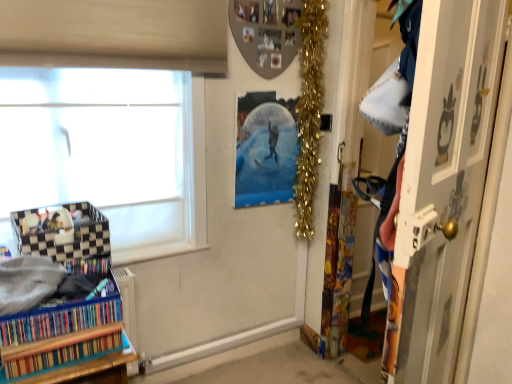
Where is `metallic silver snow globe at upper center`? This screenshot has height=384, width=512. metallic silver snow globe at upper center is located at coordinates (265, 149).

The height and width of the screenshot is (384, 512). Describe the element at coordinates (265, 149) in the screenshot. I see `metallic silver snow globe at upper center` at that location.

Where is `wooden door at right`? This screenshot has width=512, height=384. wooden door at right is located at coordinates (442, 186).

What is the approximate height of multicolored cardboard at lower left, which is the second book from bottom to top?

It is 10.15 centimeters.

Image resolution: width=512 pixels, height=384 pixels. In order to click on multicolored cardboard at lower left, which is the second book from bottom to top in this screenshot , I will do `click(59, 320)`.

This screenshot has width=512, height=384. I want to click on metallic silver snow globe at upper center, so click(x=265, y=149).

Considering the relative positions of gold tinsel garland at upper right and multicolored cardboard book at lower left, which is counted as the 1th book, starting from the bottom, in the image provided, is gold tinsel garland at upper right to the right of multicolored cardboard book at lower left, which is counted as the 1th book, starting from the bottom, from the viewer's perspective?

→ Yes.

Is multicolored cardboard book at lower left, which is counted as the 1th book, starting from the bottom, at the back of gold tinsel garland at upper right?

No, multicolored cardboard book at lower left, which is counted as the 1th book, starting from the bottom, is not at the back of gold tinsel garland at upper right.

From a real-world perspective, between gold tinsel garland at upper right and multicolored cardboard book at lower left, which is counted as the 1th book, starting from the bottom, who is vertically higher?

In real-world perspective, gold tinsel garland at upper right is above.

What's the angular difference between gold tinsel garland at upper right and multicolored cardboard book at lower left, which is counted as the 1th book, starting from the bottom,'s facing directions?

The facing directions of gold tinsel garland at upper right and multicolored cardboard book at lower left, which is counted as the 1th book, starting from the bottom, are 1.8 degrees apart.

Is checkered fabric basket at lower left wider or thinner than metallic silver snow globe at upper center?

Considering their sizes, checkered fabric basket at lower left looks broader than metallic silver snow globe at upper center.

Based on the photo, is metallic silver snow globe at upper center inside checkered fabric basket at lower left?

Definitely not — metallic silver snow globe at upper center is not inside checkered fabric basket at lower left.

Could you measure the distance between checkered fabric basket at lower left and metallic silver snow globe at upper center?

95.15 centimeters.

Could you tell me if checkered fabric basket at lower left is turned towards metallic silver snow globe at upper center?

No, checkered fabric basket at lower left does not turn towards metallic silver snow globe at upper center.

How many degrees apart are the facing directions of gold tinsel garland at upper right and metallic silver snow globe at upper center?

The facing directions of gold tinsel garland at upper right and metallic silver snow globe at upper center are 1.43 degrees apart.

Is gold tinsel garland at upper right positioned with its back to metallic silver snow globe at upper center?

Yes.

Considering the sizes of gold tinsel garland at upper right and metallic silver snow globe at upper center in the image, is gold tinsel garland at upper right bigger or smaller than metallic silver snow globe at upper center?

Clearly, gold tinsel garland at upper right is larger in size than metallic silver snow globe at upper center.

I want to click on christmas decoration in front of the metallic silver snow globe at upper center, so click(309, 111).

From the image's perspective, which is below, metallic silver snow globe at upper center or gold tinsel garland at upper right?

metallic silver snow globe at upper center is shown below in the image.

From a real-world perspective, is metallic silver snow globe at upper center below gold tinsel garland at upper right?

Yes, from a real-world perspective, metallic silver snow globe at upper center is beneath gold tinsel garland at upper right.

Which is more to the left, metallic silver snow globe at upper center or gold tinsel garland at upper right?

metallic silver snow globe at upper center is more to the left.

The height and width of the screenshot is (384, 512). I want to click on picture frame beneath the gold tinsel garland at upper right (from a real-world perspective), so click(x=265, y=149).

Who is taller, gold tinsel garland at upper right or checkered fabric basket at lower left?

gold tinsel garland at upper right is taller.

Does gold tinsel garland at upper right have a lesser width compared to checkered fabric basket at lower left?

Indeed, gold tinsel garland at upper right has a lesser width compared to checkered fabric basket at lower left.

Can you confirm if gold tinsel garland at upper right is positioned to the right of checkered fabric basket at lower left?

Indeed, gold tinsel garland at upper right is positioned on the right side of checkered fabric basket at lower left.

From a real-world perspective, is gold tinsel garland at upper right below checkered fabric basket at lower left?

No, from a real-world perspective, gold tinsel garland at upper right is not under checkered fabric basket at lower left.

Where is `the 2nd book to the left when counting from the gold tinsel garland at upper right`? This screenshot has height=384, width=512. the 2nd book to the left when counting from the gold tinsel garland at upper right is located at coordinates pyautogui.click(x=59, y=320).

Considering the sizes of objects multicolored cardboard at lower left, which is the second book from bottom to top, and gold tinsel garland at upper right in the image provided, who is shorter, multicolored cardboard at lower left, which is the second book from bottom to top, or gold tinsel garland at upper right?

multicolored cardboard at lower left, which is the second book from bottom to top, is shorter.

Is multicolored cardboard at lower left, placed as the 1th book when sorted from top to bottom, further to camera compared to gold tinsel garland at upper right?

No, multicolored cardboard at lower left, placed as the 1th book when sorted from top to bottom, is in front of gold tinsel garland at upper right.

Between white frosted glass window at left and wooden door at right, which one has larger width?

wooden door at right is wider.

Would you say white frosted glass window at left is outside wooden door at right?

Yes.

Could you tell me if white frosted glass window at left is facing wooden door at right?

No.

Where is `christmas decoration above the multicolored cardboard book at lower left, which is the second book from top to bottom (from a real-world perspective)`? The height and width of the screenshot is (384, 512). christmas decoration above the multicolored cardboard book at lower left, which is the second book from top to bottom (from a real-world perspective) is located at coordinates (309, 111).

Image resolution: width=512 pixels, height=384 pixels. Find the location of `shelf directly beneath the metallic silver snow globe at upper center (from a real-world perspective)`. shelf directly beneath the metallic silver snow globe at upper center (from a real-world perspective) is located at coordinates (65, 241).

Considering their positions, is gold tinsel garland at upper right positioned closer to wooden door at right than multicolored cardboard book at lower left, which is counted as the 1th book, starting from the bottom?

gold tinsel garland at upper right is positioned closer to the anchor wooden door at right.

Estimate the real-world distances between objects in this image. Which object is closer to wooden door at right, multicolored cardboard book at lower left, which is the second book from top to bottom, or white frosted glass window at left?

multicolored cardboard book at lower left, which is the second book from top to bottom, lies closer to wooden door at right than the other object.

Based on their spatial positions, is checkered fabric basket at lower left or multicolored cardboard at lower left, placed as the 1th book when sorted from top to bottom, further from wooden door at right?

checkered fabric basket at lower left.

Looking at this image, based on their spatial positions, is wooden door at right or white frosted glass window at left closer to metallic silver snow globe at upper center?

The object closer to metallic silver snow globe at upper center is white frosted glass window at left.

When comparing their distances from checkered fabric basket at lower left, does white frosted glass window at left or gold tinsel garland at upper right seem further?

gold tinsel garland at upper right lies further to checkered fabric basket at lower left than the other object.

Which object lies further to the anchor point checkered fabric basket at lower left, gold tinsel garland at upper right or wooden door at right?

The object further to checkered fabric basket at lower left is gold tinsel garland at upper right.

Looking at the image, which one is located closer to multicolored cardboard book at lower left, which is the second book from top to bottom, multicolored cardboard at lower left, placed as the 1th book when sorted from top to bottom, or wooden door at right?

multicolored cardboard at lower left, placed as the 1th book when sorted from top to bottom, is positioned closer to the anchor multicolored cardboard book at lower left, which is the second book from top to bottom.

Which object lies nearer to the anchor point wooden door at right, multicolored cardboard at lower left, placed as the 1th book when sorted from top to bottom, or checkered fabric basket at lower left?

Among the two, multicolored cardboard at lower left, placed as the 1th book when sorted from top to bottom, is located nearer to wooden door at right.

Where is `window located between checkered fabric basket at lower left and metallic silver snow globe at upper center in the left-right direction`? window located between checkered fabric basket at lower left and metallic silver snow globe at upper center in the left-right direction is located at coordinates (109, 152).

Image resolution: width=512 pixels, height=384 pixels. What are the coordinates of `picture frame between checkered fabric basket at lower left and wooden door at right` in the screenshot? It's located at (265, 149).

Where is `book between multicolored cardboard book at lower left, which is the second book from top to bottom, and metallic silver snow globe at upper center in the front-back direction`? book between multicolored cardboard book at lower left, which is the second book from top to bottom, and metallic silver snow globe at upper center in the front-back direction is located at coordinates (59, 320).

This screenshot has height=384, width=512. I want to click on christmas decoration located between multicolored cardboard at lower left, placed as the 1th book when sorted from top to bottom, and wooden door at right in the left-right direction, so click(x=309, y=111).